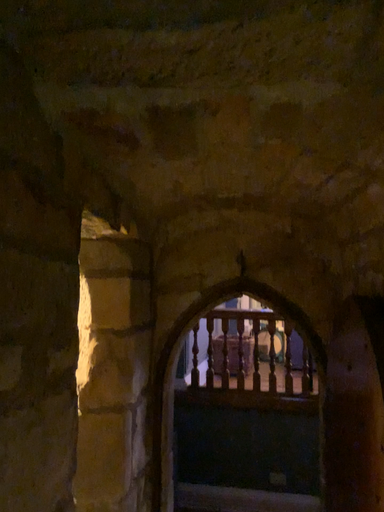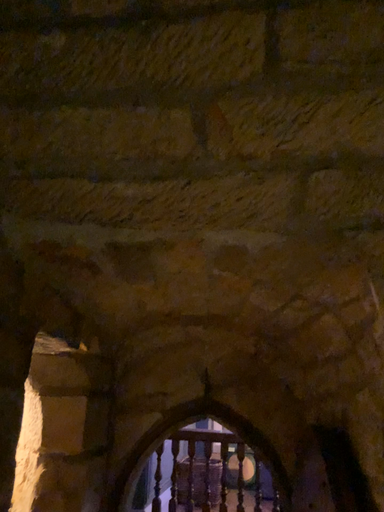
Question: Which way did the camera rotate in the video?

Choices:
 (A) rotated upward
 (B) rotated downward

Answer: (A)